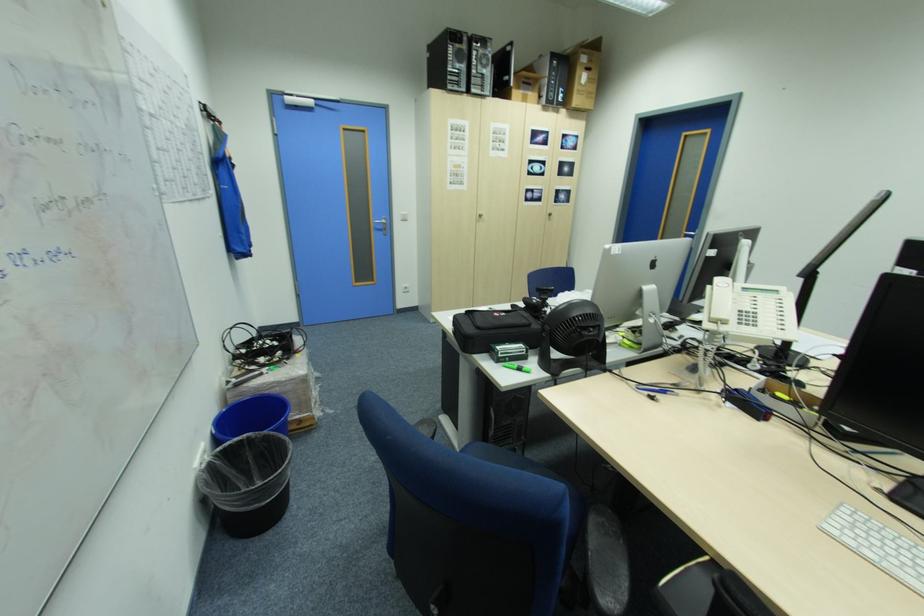
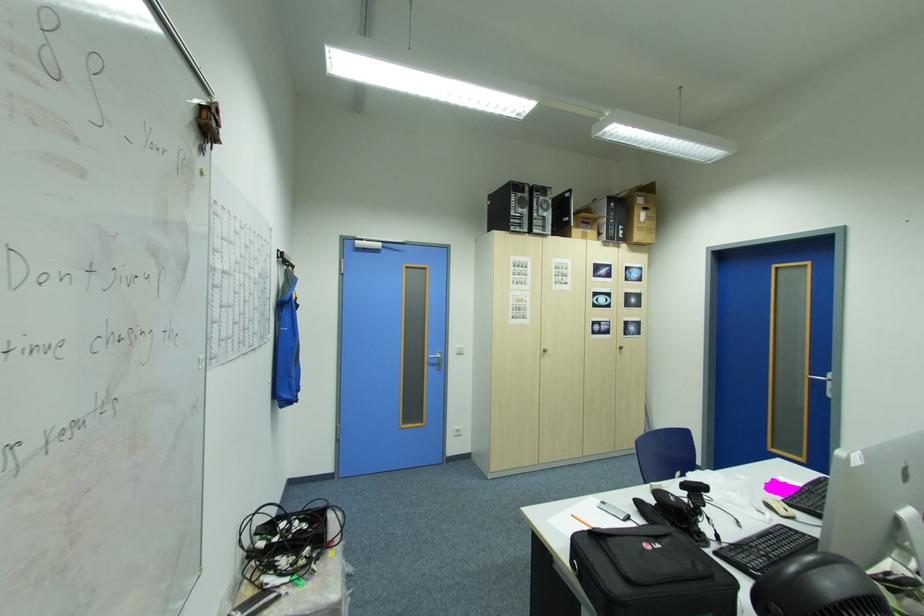
Locate, in the second image, the point that corresponds to point (464, 67) in the first image.

(527, 212)